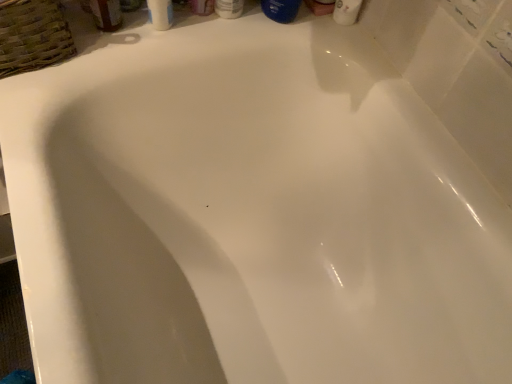
Find the location of a particular element. This screenshot has height=384, width=512. free space in front of blue glossy bottle at upper center, the second mouthwash in the left-to-right sequence is located at coordinates (255, 31).